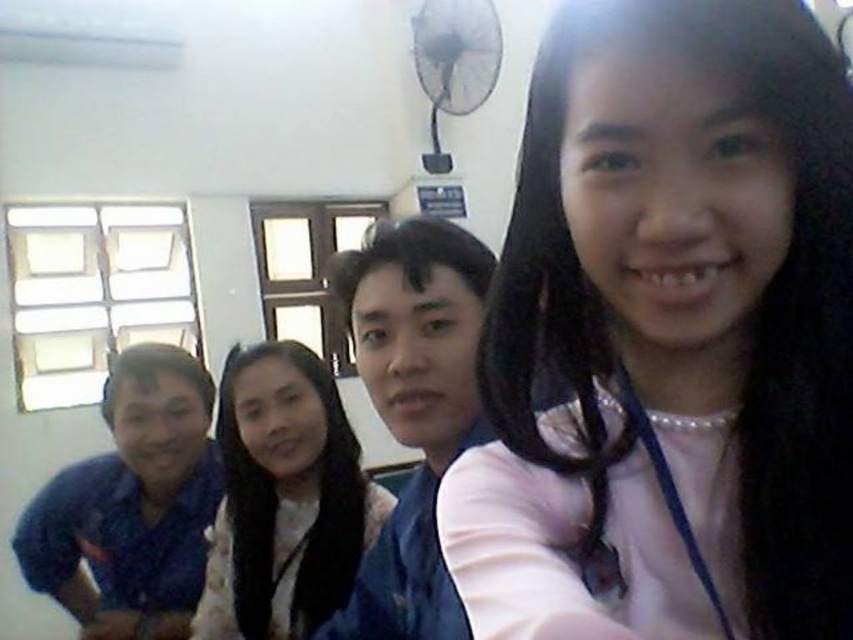
Can you confirm if pink fabric at center is thinner than smooth white shirt at center?

Indeed, pink fabric at center has a lesser width compared to smooth white shirt at center.

This screenshot has width=853, height=640. Find the location of `pink fabric at center`. pink fabric at center is located at coordinates (669, 337).

What do you see at coordinates (669, 337) in the screenshot?
I see `pink fabric at center` at bounding box center [669, 337].

Locate an element on the screen. pink fabric at center is located at coordinates (669, 337).

Looking at this image, between blue denim jacket at center and smooth white shirt at center, which one appears on the right side from the viewer's perspective?

blue denim jacket at center

Which is in front, point (372, 358) or point (337, 394)?

Point (372, 358) is in front.

Locate an element on the screen. The height and width of the screenshot is (640, 853). blue denim jacket at center is located at coordinates (413, 408).

Based on the photo, is pink fabric at center wider than blue denim jacket at center?

Indeed, pink fabric at center has a greater width compared to blue denim jacket at center.

The image size is (853, 640). I want to click on pink fabric at center, so click(x=669, y=337).

Which is behind, point (650, 330) or point (434, 609)?

The point (434, 609) is behind.

The image size is (853, 640). In order to click on pink fabric at center in this screenshot , I will do `click(669, 337)`.